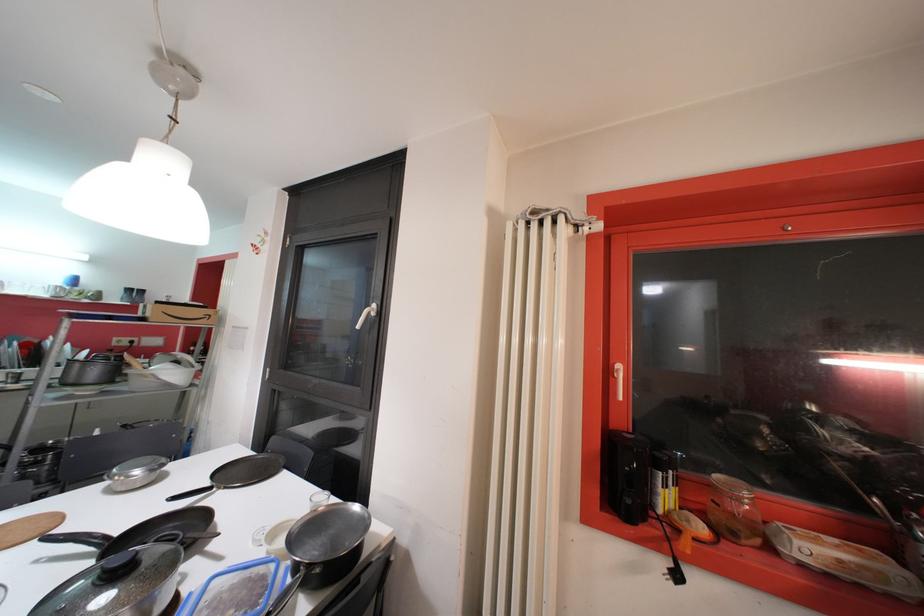
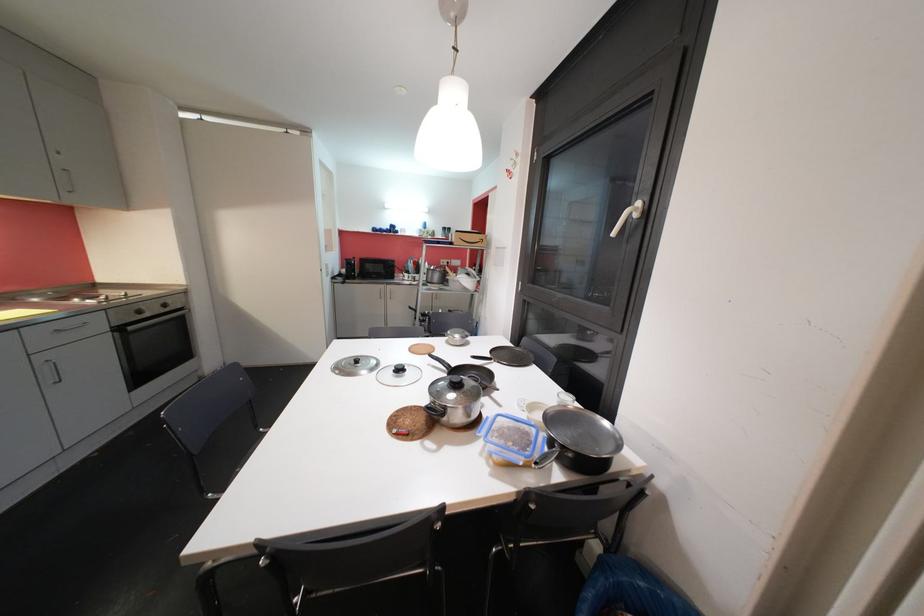
Question: The first image is from the beginning of the video and the second image is from the end. How did the camera likely rotate when shooting the video?

Choices:
 (A) Left
 (B) Right
 (C) Up
 (D) Down

Answer: (A)